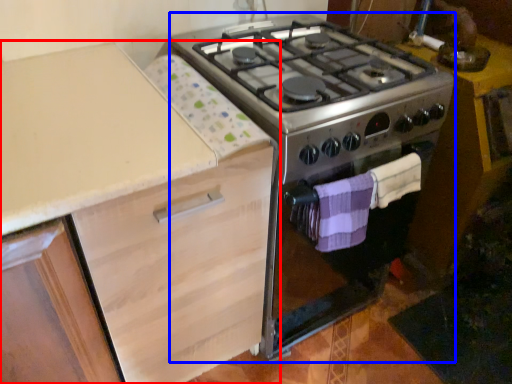
Question: Which of the following is the closest to the observer, cabinetry (highlighted by a red box) or appliance (highlighted by a blue box)?

Choices:
 (A) cabinetry
 (B) appliance

Answer: (A)